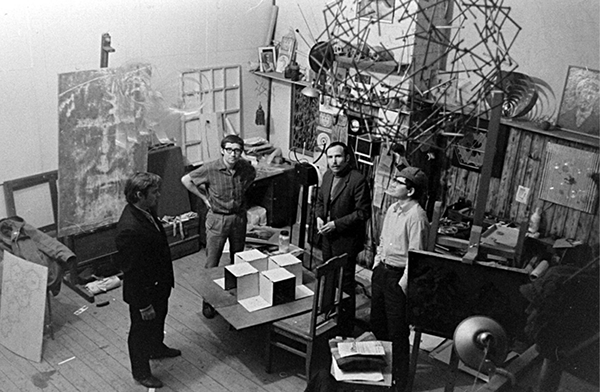
This screenshot has height=392, width=600. I want to click on wall, so click(x=190, y=44), click(x=544, y=42).